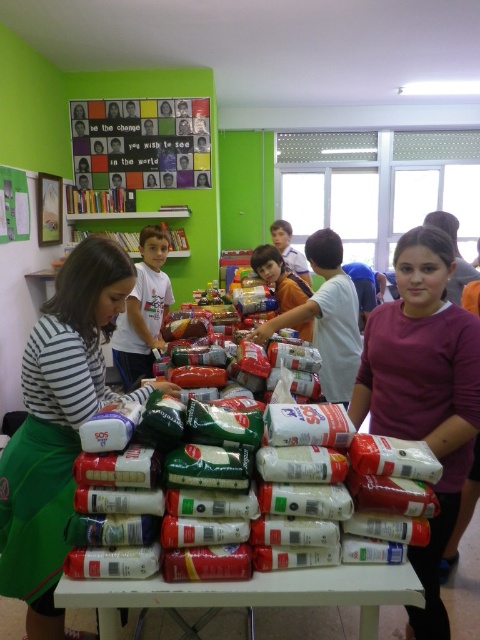
From the picture: You are standing in front of the table with food items and need to reach two points marked on the floor. The first point is at coordinates point (115, 435) and the second is at point (131, 387). Which point is closer to you?

Point (115, 435) is closer to the viewer than point (131, 387).

You are organizing a food drive and need to place a new box of canned goods on the table. The white plastic table at center has limited space. Where should you place the new box to ensure it doesn t block access to the white matte rice at center?

You should place the new box of canned goods to the left of the white plastic table at center, since the white matte rice at center is already positioned to the right of the table. This way, the new box won t obstruct access to the rice located on the right side of the table.

You are helping organize the community event and need to stack more items on the table. Considering the white matte rice at center and the white cotton shirt at center, which item can you place additional items on top of without collapsing?

The white matte rice at center can have additional items placed on top since it has a lesser height compared to the white cotton shirt at center, making it more stable for stacking.